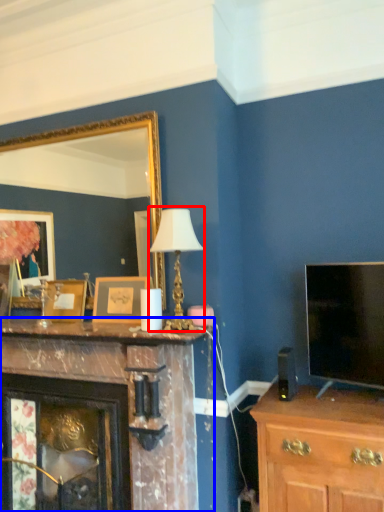
Question: Which object appears closest to the camera in this image, table lamp (highlighted by a red box) or fireplace (highlighted by a blue box)?

Choices:
 (A) table lamp
 (B) fireplace

Answer: (B)